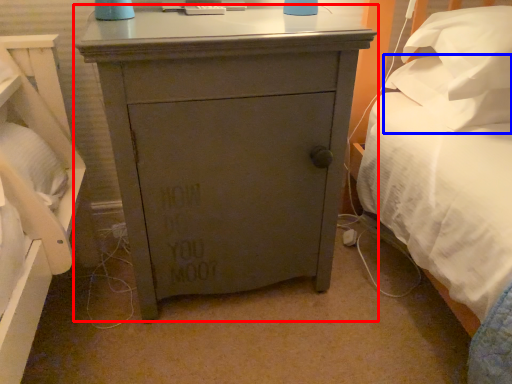
Question: Among these objects, which one is farthest to the camera, chest of drawers (highlighted by a red box) or pillow (highlighted by a blue box)?

Choices:
 (A) chest of drawers
 (B) pillow

Answer: (B)